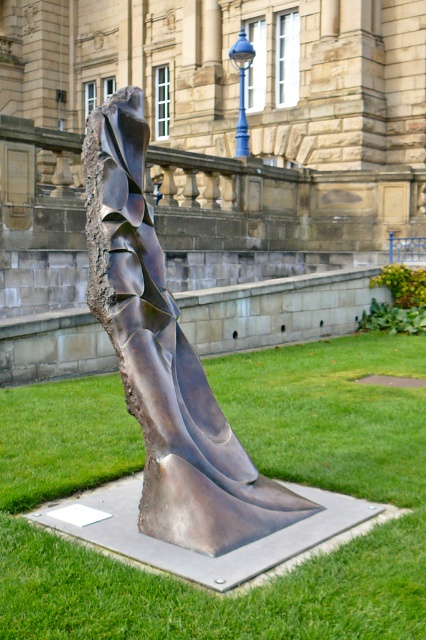
Question: Can you confirm if green grass at center is bigger than bronze sculpture at center?

Choices:
 (A) no
 (B) yes

Answer: (A)

Question: Among these objects, which one is nearest to the camera?

Choices:
 (A) bronze sculpture at center
 (B) green grass at center

Answer: (B)

Question: Can you confirm if green grass at center is bigger than bronze sculpture at center?

Choices:
 (A) yes
 (B) no

Answer: (B)

Question: Does green grass at center appear on the left side of bronze sculpture at center?

Choices:
 (A) no
 (B) yes

Answer: (B)

Question: Among these objects, which one is farthest from the camera?

Choices:
 (A) green grass at center
 (B) bronze sculpture at center

Answer: (B)